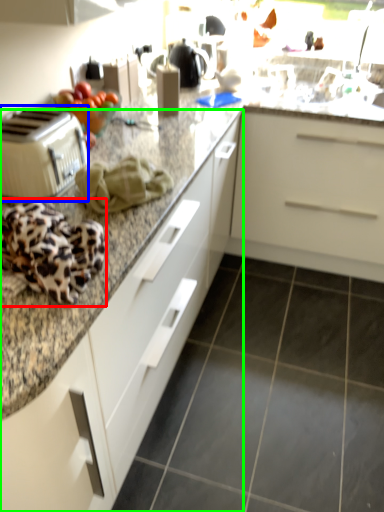
Question: Considering the real-world distances, which object is farthest from blanket (highlighted by a red box)? toaster (highlighted by a blue box) or cabinetry (highlighted by a green box)?

Choices:
 (A) toaster
 (B) cabinetry

Answer: (B)